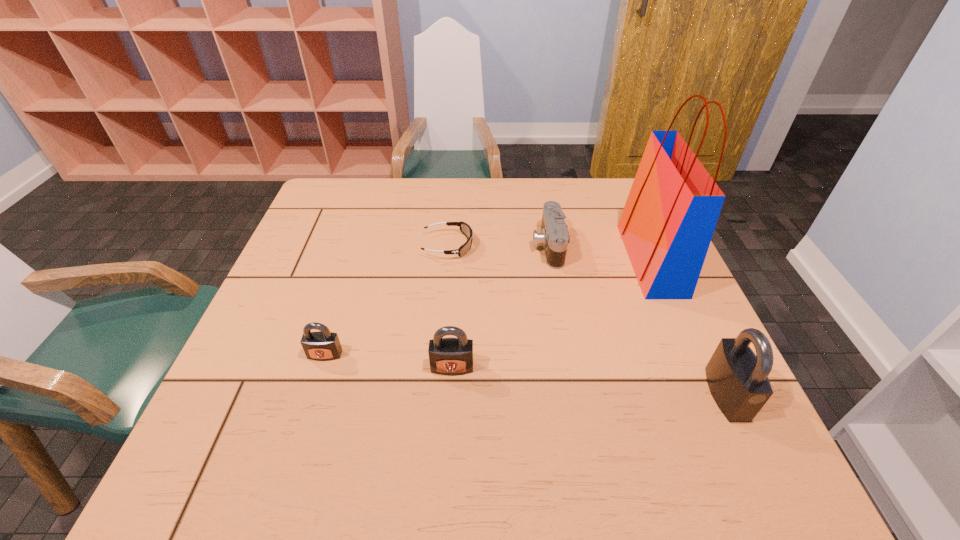
Locate an element on the screen. the shortest padlock is located at coordinates (323, 345).

Where is `the leftmost padlock`? the leftmost padlock is located at coordinates (323, 345).

Where is `the third tallest object`? Image resolution: width=960 pixels, height=540 pixels. the third tallest object is located at coordinates (450, 356).

Find the location of a particular element. This screenshot has height=540, width=960. the second padlock from left to right is located at coordinates 450,356.

Find the location of a particular element. the tallest padlock is located at coordinates (738, 380).

Locate an element on the screen. Image resolution: width=960 pixels, height=540 pixels. the fifth shortest object is located at coordinates pos(738,380).

In order to click on camera in this screenshot , I will do `click(554, 237)`.

Find the location of a particular element. This screenshot has height=540, width=960. goggles is located at coordinates (465, 229).

Find the location of a particular element. the tallest object is located at coordinates (672, 209).

Find the location of a particular element. free spot located on the front of the leftmost object near the keyhole is located at coordinates (306, 413).